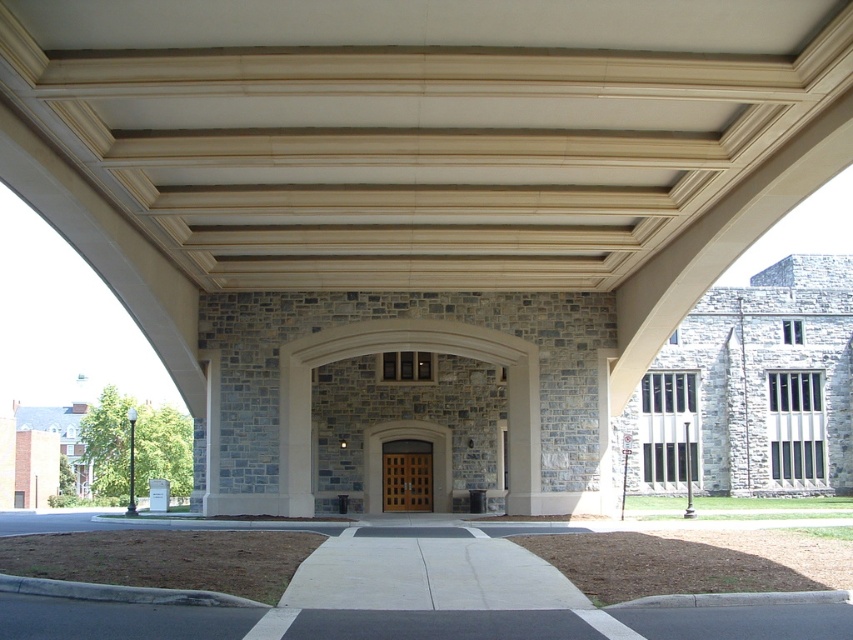
You are standing at the entrance of the classical building and want to move towards the two points marked on the ceiling. Which point, point (445,497) or point (405,456), is closer to you as you face the entrance?

Point (445,497) is closer to you because it is in front of point (405,456).

You are standing at point A, which is at point (376,474). You need to walk to point B, which is 33.95 meters away from point A. Can you estimate how long it would take you to walk from point A to point B at a normal walking speed of 1.4 meters per second?

The distance between point A and point B is 33.95 meters. At a normal walking speed of 1.4 meters per second, it would take approximately 24.25 seconds to walk from point A to point B.